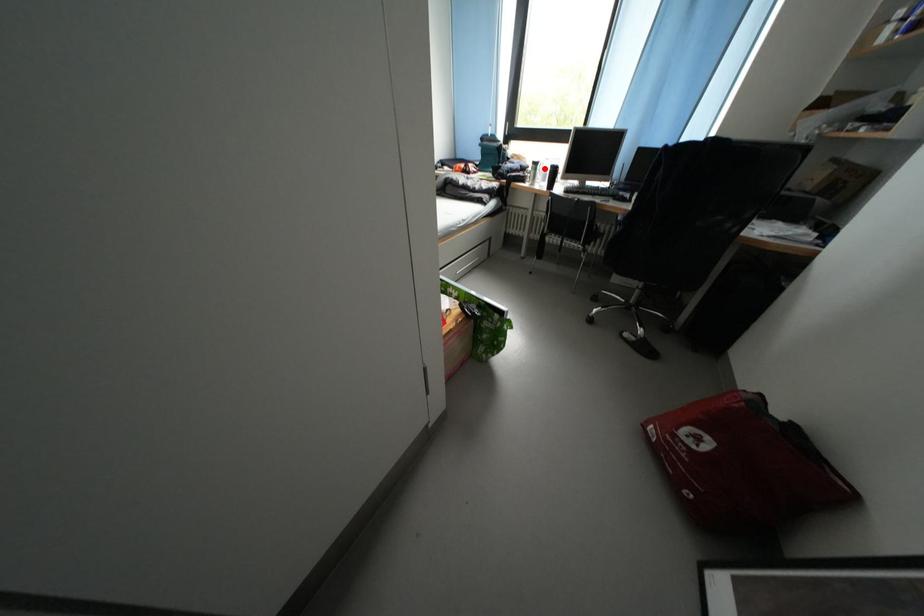
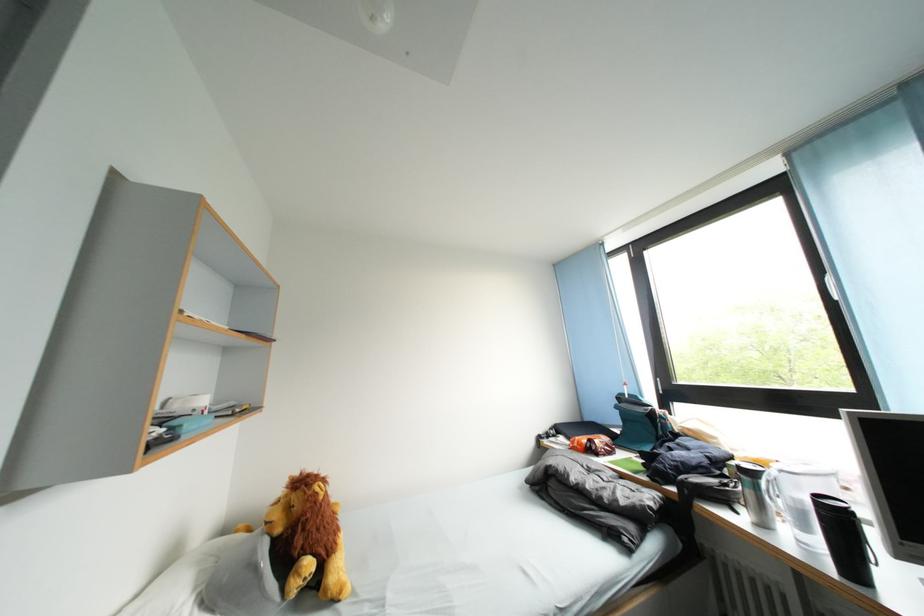
Question: I am providing you with two images of the same scene from different viewpoints. Given a red point in image1, look at the same physical point in image2. Is it:

Choices:
 (A) Closer to the viewpoint
 (B) Farther from the viewpoint

Answer: (B)